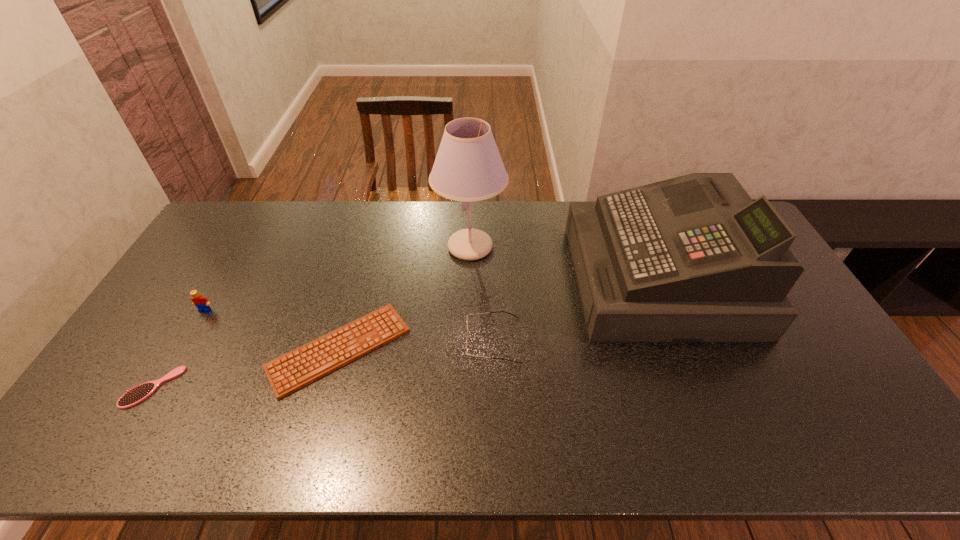
This screenshot has height=540, width=960. I want to click on Lego that is at the left edge, so click(202, 304).

Locate an element on the screen. The image size is (960, 540). hairbrush present at the left edge is located at coordinates (134, 396).

Locate an element on the screen. The image size is (960, 540). object present at the right edge is located at coordinates (690, 259).

You are a GUI agent. You are given a task and a screenshot of the screen. Output one action in this format:
    pyautogui.click(x=<x>, y=<y>)
    Task: Click on the object at the far right corner
    
    Given the screenshot: What is the action you would take?
    pyautogui.click(x=690, y=259)

At what (x,y) coordinates should I click in order to perform the action: click on vacant area at the far edge of the desktop. Please return your answer as a coordinate pair (x, y). Image resolution: width=960 pixels, height=540 pixels. Looking at the image, I should click on (369, 225).

You are a GUI agent. You are given a task and a screenshot of the screen. Output one action in this format:
    pyautogui.click(x=<x>, y=<y>)
    Task: Click on the free region at the near edge of the desktop
    The height and width of the screenshot is (540, 960).
    Given the screenshot: What is the action you would take?
    pyautogui.click(x=402, y=454)

You are a GUI agent. You are given a task and a screenshot of the screen. Output one action in this format:
    pyautogui.click(x=<x>, y=<y>)
    Task: Click on the vacant space at the left edge of the desktop
    Image resolution: width=960 pixels, height=540 pixels.
    Given the screenshot: What is the action you would take?
    pyautogui.click(x=182, y=291)

The width and height of the screenshot is (960, 540). Find the location of `free space at the far left corner`. free space at the far left corner is located at coordinates (216, 235).

At what (x,y) coordinates should I click in order to perform the action: click on vacant space in between the second tallest object and the third shortest object. Please return your answer as a coordinate pair (x, y). This screenshot has width=960, height=540. Looking at the image, I should click on (576, 309).

What are the coordinates of `empty space between the computer keyboard and the cash register` in the screenshot? It's located at (499, 314).